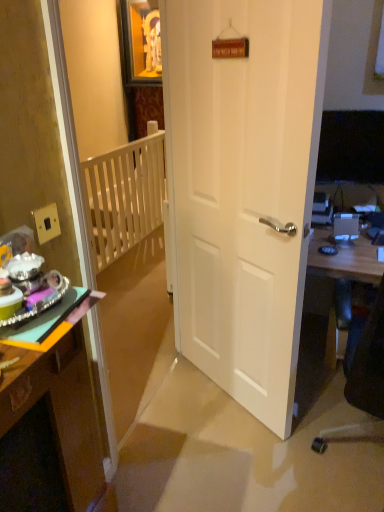
Question: Is wooden desk at right at the back of wooden desk at left?

Choices:
 (A) no
 (B) yes

Answer: (A)

Question: Is wooden desk at left not inside wooden desk at right?

Choices:
 (A) yes
 (B) no

Answer: (A)

Question: Is wooden desk at left aimed at wooden desk at right?

Choices:
 (A) no
 (B) yes

Answer: (A)

Question: Is wooden desk at left shorter than wooden desk at right?

Choices:
 (A) yes
 (B) no

Answer: (B)

Question: From the image's perspective, is wooden desk at left on wooden desk at right?

Choices:
 (A) yes
 (B) no

Answer: (B)

Question: Would you say white wooden balustrade at left is to the left or to the right of white matte door at center in the picture?

Choices:
 (A) left
 (B) right

Answer: (A)

Question: Is point (127, 218) closer or farther from the camera than point (296, 361)?

Choices:
 (A) farther
 (B) closer

Answer: (A)

Question: Which is correct: white wooden balustrade at left is inside white matte door at center, or outside of it?

Choices:
 (A) inside
 (B) outside

Answer: (B)

Question: Considering the positions of white wooden balustrade at left and white matte door at center in the image, is white wooden balustrade at left wider or thinner than white matte door at center?

Choices:
 (A) wide
 (B) thin

Answer: (A)

Question: Looking at their shapes, would you say white wooden bunk bed at upper left is wider or thinner than white matte door at center?

Choices:
 (A) thin
 (B) wide

Answer: (A)

Question: Based on their positions, is white wooden bunk bed at upper left located to the left or right of white matte door at center?

Choices:
 (A) left
 (B) right

Answer: (A)

Question: From a real-world perspective, is white wooden bunk bed at upper left above or below white matte door at center?

Choices:
 (A) below
 (B) above

Answer: (B)

Question: From the image's perspective, is white wooden bunk bed at upper left positioned above or below white matte door at center?

Choices:
 (A) above
 (B) below

Answer: (B)

Question: From the image's perspective, is white wooden bunk bed at upper left located above or below wooden desk at right?

Choices:
 (A) below
 (B) above

Answer: (B)

Question: From a real-world perspective, relative to wooden desk at right, is white wooden bunk bed at upper left vertically above or below?

Choices:
 (A) above
 (B) below

Answer: (A)